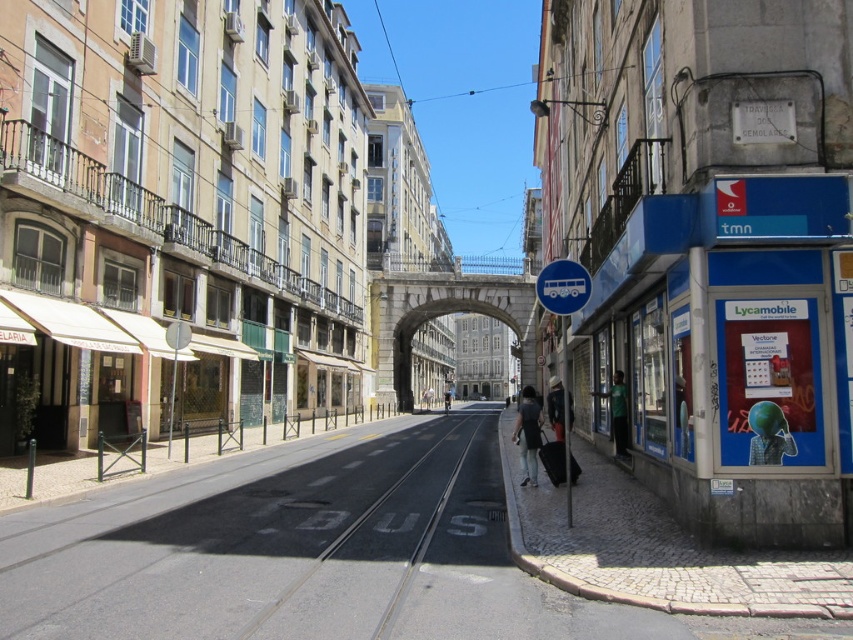
You are a tourist standing on the sidewalk in Lisbon and see a person wearing dark gray jeans at center and another wearing a green matte shirt at center. Which person is closer to the tram tracks on the right side of the street?

The dark gray jeans at center is to the right of green matte shirt at center, so the person wearing dark gray jeans at center is closer to the tram tracks on the right side of the street.

You are a photographer trying to capture the entire scene of the European city street with both the dark gray jeans at center and the dark gray fabric jacket at center in the frame. Since you want to include as much of the background architecture as possible, which object should you focus on to ensure both are in the frame?

You should focus on the dark gray jeans at center because it is larger in size than the dark gray fabric jacket at center, allowing you to frame both while keeping the background architecture visible.

You are a delivery person trying to cross the street while avoiding the black asphalt train track at center and the dark gray fabric jacket at center. Which object should you avoid stepping on?

You should avoid stepping on the black asphalt train track at center because it is located below the dark gray fabric jacket at center, meaning the track is on the ground while the jacket is likely being worn by a pedestrian.